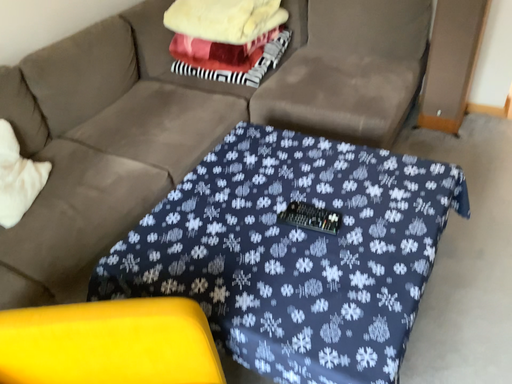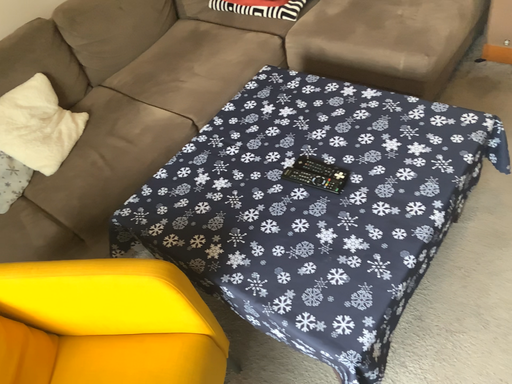
Question: How did the camera likely rotate when shooting the video?

Choices:
 (A) rotated downward
 (B) rotated upward

Answer: (A)